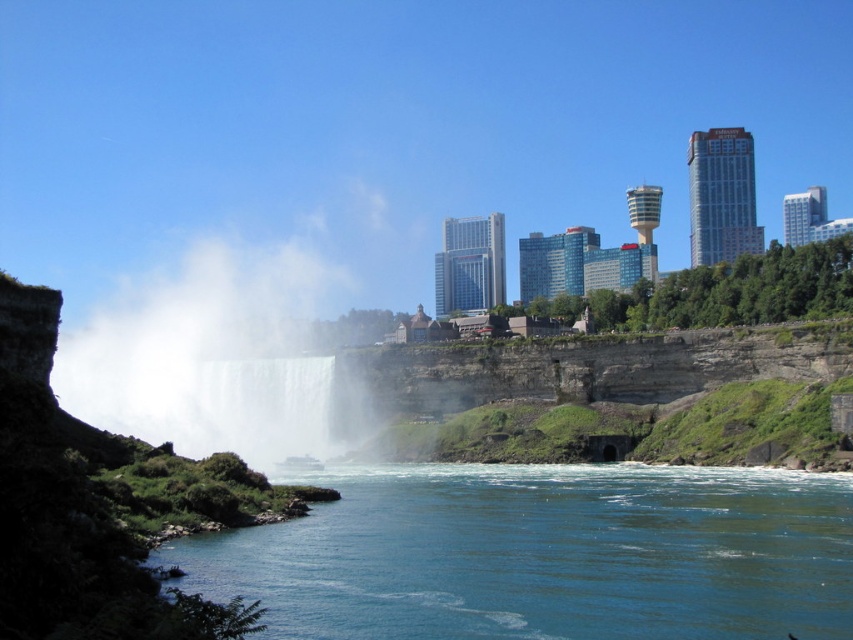
Who is higher up, clear blue water at lower center or white misty waterfall at center?

white misty waterfall at center is above.

Is clear blue water at lower center thinner than white misty waterfall at center?

No, clear blue water at lower center is not thinner than white misty waterfall at center.

Does point (401, 490) come closer to viewer compared to point (219, 433)?

Yes.

This screenshot has height=640, width=853. I want to click on clear blue water at lower center, so click(x=543, y=554).